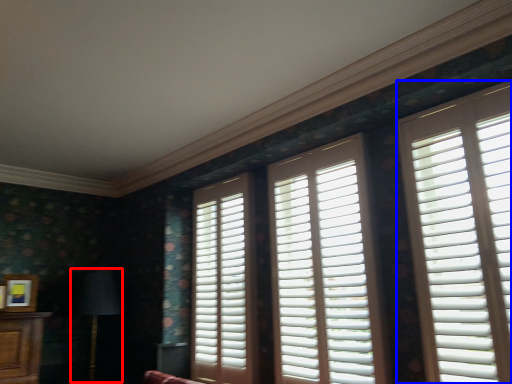
Question: Which of the following is the closest to the observer, table lamp (highlighted by a red box) or window (highlighted by a blue box)?

Choices:
 (A) table lamp
 (B) window

Answer: (B)